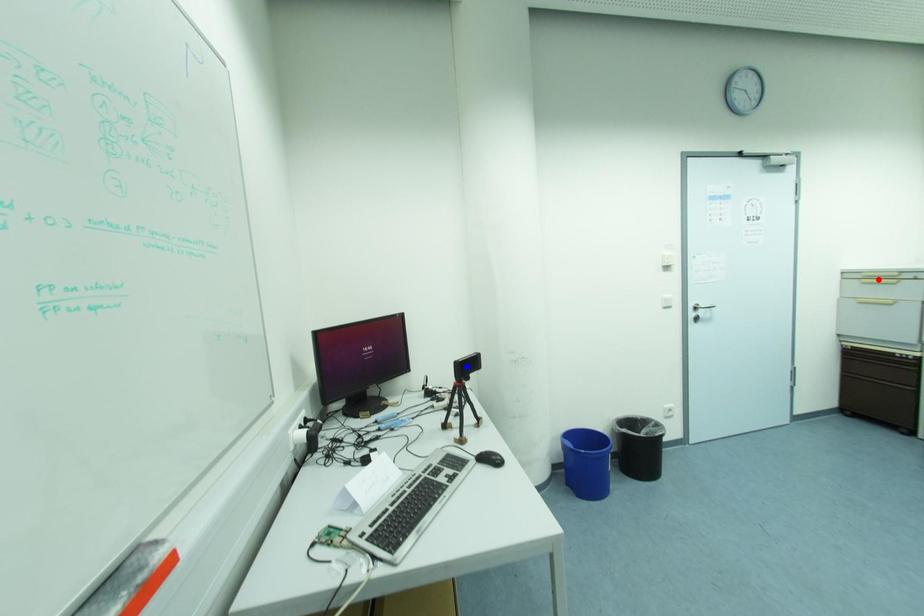
Question: Which of the two points in the image is closer to the camera?

Choices:
 (A) Blue point is closer.
 (B) Red point is closer.

Answer: (A)